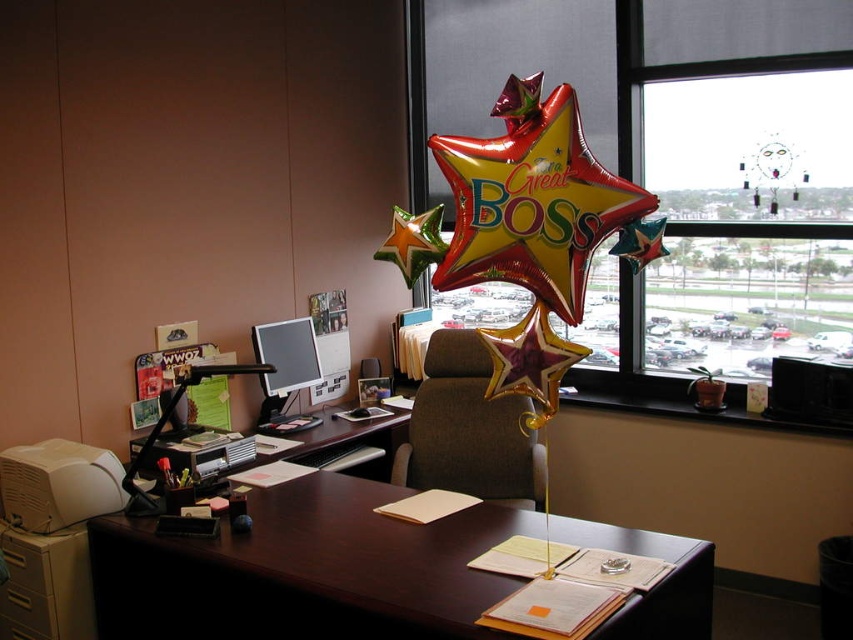
You need to place a new keyboard that is the same size as the matte black monitor at center on the dark wood desk at center. Will it fit?

The dark wood desk at center has a larger size compared to matte black monitor at center. Since the desk is bigger, the keyboard, which is the same size as the monitor, should fit on the dark wood desk at center.

You are an office worker trying to determine if you can hang a large poster on the transparent glass window at upper center or the brown wood computer desk at center. Based on their sizes, which surface can accommodate the poster better?

The transparent glass window at upper center is larger in size than the brown wood computer desk at center, so the poster will fit better on the transparent glass window at upper center.